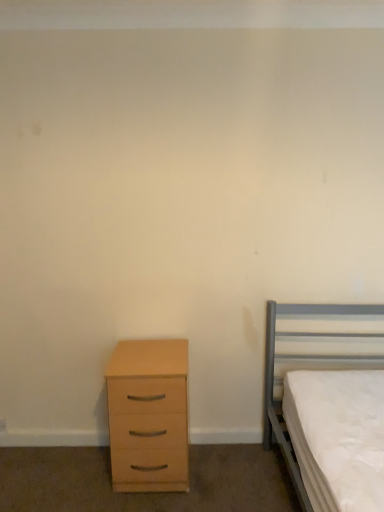
Question: Is light wood/veneer chest of drawers at lower left bigger or smaller than metallic gray bed at right?

Choices:
 (A) small
 (B) big

Answer: (A)

Question: Is point (185, 391) closer or farther from the camera than point (329, 308)?

Choices:
 (A) closer
 (B) farther

Answer: (B)

Question: Considering the positions of light wood/veneer chest of drawers at lower left and metallic gray bed at right in the image, is light wood/veneer chest of drawers at lower left taller or shorter than metallic gray bed at right?

Choices:
 (A) tall
 (B) short

Answer: (B)

Question: Is metallic gray bed at right wider or thinner than light wood/veneer chest of drawers at lower left?

Choices:
 (A) thin
 (B) wide

Answer: (B)

Question: From their relative heights in the image, would you say metallic gray bed at right is taller or shorter than light wood/veneer chest of drawers at lower left?

Choices:
 (A) short
 (B) tall

Answer: (B)

Question: Does point (268, 395) appear closer or farther from the camera than point (117, 444)?

Choices:
 (A) farther
 (B) closer

Answer: (A)

Question: In the image, is metallic gray bed at right positioned in front of or behind light wood/veneer chest of drawers at lower left?

Choices:
 (A) front
 (B) behind

Answer: (A)